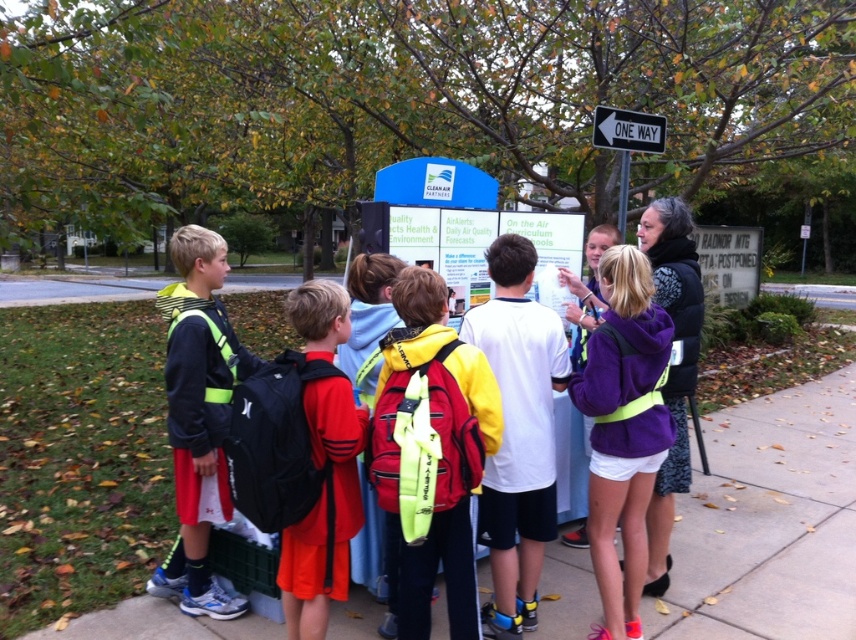
Does cement sidewalk at lower center appear on the right side of purple fleece jacket at center?

Yes, cement sidewalk at lower center is to the right of purple fleece jacket at center.

Does point (749, 412) lie in front of point (626, 256)?

No, (749, 412) is further to viewer.

Does point (116, 628) lie in front of point (633, 332)?

No, it is not.

At what (x,y) coordinates should I click in order to perform the action: click on cement sidewalk at lower center. Please return your answer as a coordinate pair (x, y). The image size is (856, 640). Looking at the image, I should click on (770, 522).

Who is higher up, cement sidewalk at lower center or matte black jacket at left?

matte black jacket at left

Can you confirm if cement sidewalk at lower center is shorter than matte black jacket at left?

Yes.

Is point (786, 556) in front of point (176, 355)?

No, it is not.

This screenshot has height=640, width=856. In order to click on cement sidewalk at lower center in this screenshot , I will do `click(770, 522)`.

Looking at this image, does cement sidewalk at lower center have a larger size compared to metallic silver arrow at upper right?

No, cement sidewalk at lower center is not bigger than metallic silver arrow at upper right.

Is cement sidewalk at lower center positioned in front of metallic silver arrow at upper right?

Yes, cement sidewalk at lower center is closer to the viewer.

You are a GUI agent. You are given a task and a screenshot of the screen. Output one action in this format:
    pyautogui.click(x=<x>, y=<y>)
    Task: Click on the cement sidewalk at lower center
    This screenshot has height=640, width=856.
    Given the screenshot: What is the action you would take?
    pyautogui.click(x=770, y=522)